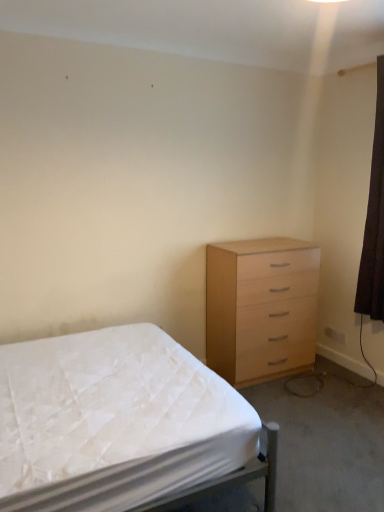
Question: From a real-world perspective, does light wood chest of drawers at right sit lower than white fabric bed at lower left?

Choices:
 (A) yes
 (B) no

Answer: (B)

Question: Is light wood chest of drawers at right with white fabric bed at lower left?

Choices:
 (A) no
 (B) yes

Answer: (A)

Question: Is white fabric bed at lower left inside light wood chest of drawers at right?

Choices:
 (A) no
 (B) yes

Answer: (A)

Question: From a real-world perspective, is light wood chest of drawers at right physically above white fabric bed at lower left?

Choices:
 (A) no
 (B) yes

Answer: (B)

Question: From the image's perspective, is light wood chest of drawers at right located beneath white fabric bed at lower left?

Choices:
 (A) no
 (B) yes

Answer: (A)

Question: Considering the positions of white fabric bed at lower left and light wood chest of drawers at right in the image, is white fabric bed at lower left taller or shorter than light wood chest of drawers at right?

Choices:
 (A) short
 (B) tall

Answer: (A)

Question: Relative to light wood chest of drawers at right, is white fabric bed at lower left in front or behind?

Choices:
 (A) front
 (B) behind

Answer: (A)

Question: Is white fabric bed at lower left wider or thinner than light wood chest of drawers at right?

Choices:
 (A) thin
 (B) wide

Answer: (B)

Question: Does point (72, 342) appear closer or farther from the camera than point (309, 315)?

Choices:
 (A) closer
 (B) farther

Answer: (A)

Question: From their relative heights in the image, would you say light wood chest of drawers at right is taller or shorter than white fabric bed at lower left?

Choices:
 (A) short
 (B) tall

Answer: (B)

Question: In terms of width, does light wood chest of drawers at right look wider or thinner when compared to white fabric bed at lower left?

Choices:
 (A) wide
 (B) thin

Answer: (B)

Question: Is point (261, 353) closer or farther from the camera than point (129, 390)?

Choices:
 (A) closer
 (B) farther

Answer: (B)

Question: From the image's perspective, is light wood chest of drawers at right located above or below white fabric bed at lower left?

Choices:
 (A) above
 (B) below

Answer: (A)

Question: In terms of width, does brown fabric curtain at right look wider or thinner when compared to light wood chest of drawers at right?

Choices:
 (A) wide
 (B) thin

Answer: (B)

Question: Relative to light wood chest of drawers at right, is brown fabric curtain at right in front or behind?

Choices:
 (A) behind
 (B) front

Answer: (B)